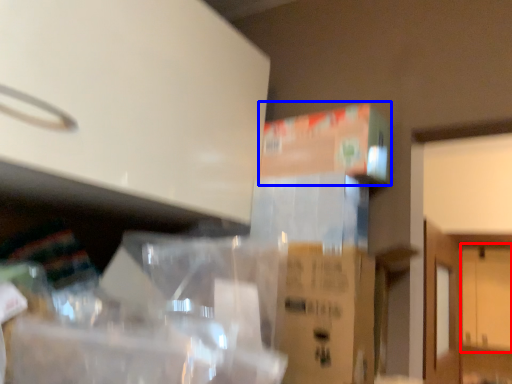
Question: Which point is closer to the camera, door (highlighted by a red box) or cardboard box (highlighted by a blue box)?

Choices:
 (A) door
 (B) cardboard box

Answer: (B)